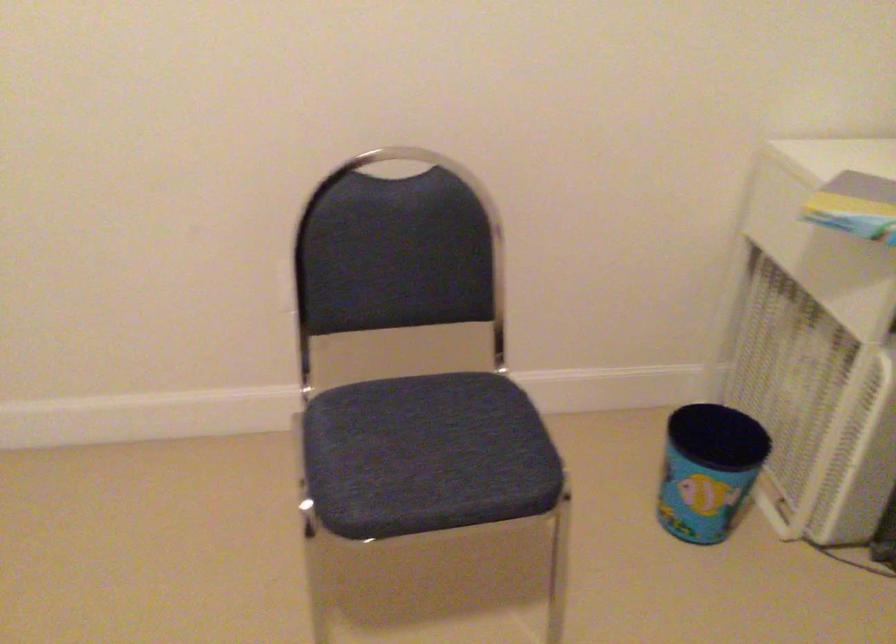
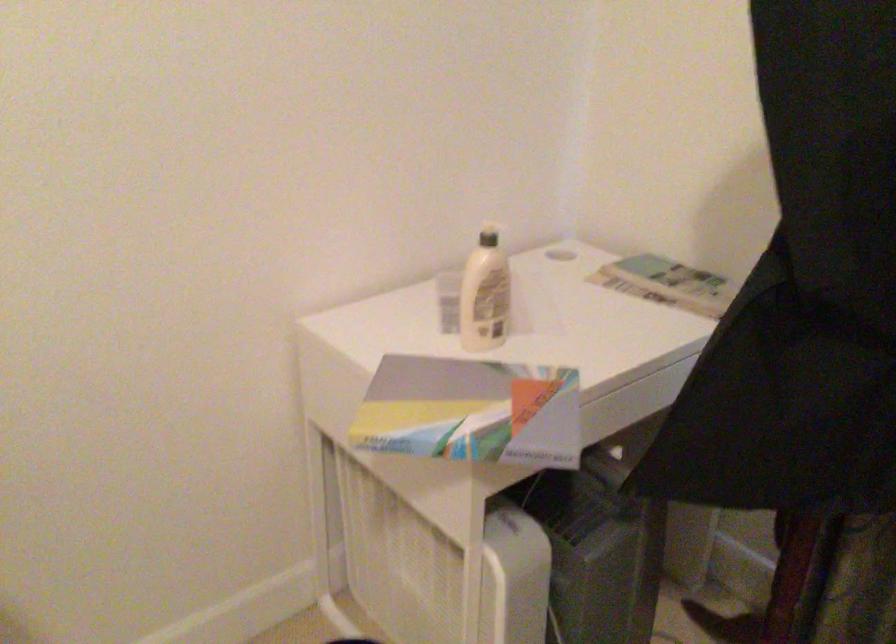
Question: The images are taken continuously from a first-person perspective. In which direction is your viewpoint rotating?

Choices:
 (A) Left
 (B) Right
 (C) Up
 (D) Down

Answer: (B)